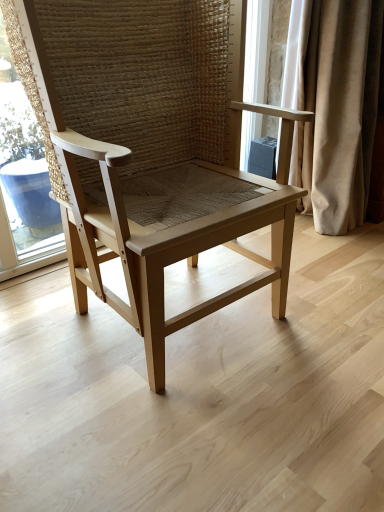
You are a GUI agent. You are given a task and a screenshot of the screen. Output one action in this format:
    pyautogui.click(x=<x>, y=<y>)
    Task: Click on the unoccupied area in front of light wood chair at center
    This screenshot has width=384, height=512.
    Given the screenshot: What is the action you would take?
    pyautogui.click(x=182, y=428)